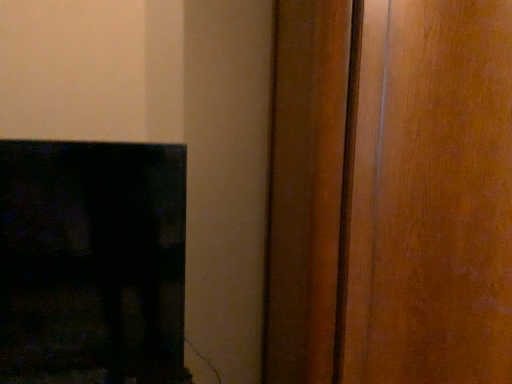
In order to face black glossy fireplace at lower left, should I rotate leftwards or rightwards?

You should rotate left by 21.473 degrees.

Identify the location of black glossy fireplace at lower left. (92, 263).

Describe the element at coordinates (92, 263) in the screenshot. I see `black glossy fireplace at lower left` at that location.

At what (x,y) coordinates should I click in order to perform the action: click on black glossy fireplace at lower left. Please return your answer as a coordinate pair (x, y). Image resolution: width=512 pixels, height=384 pixels. Looking at the image, I should click on (92, 263).